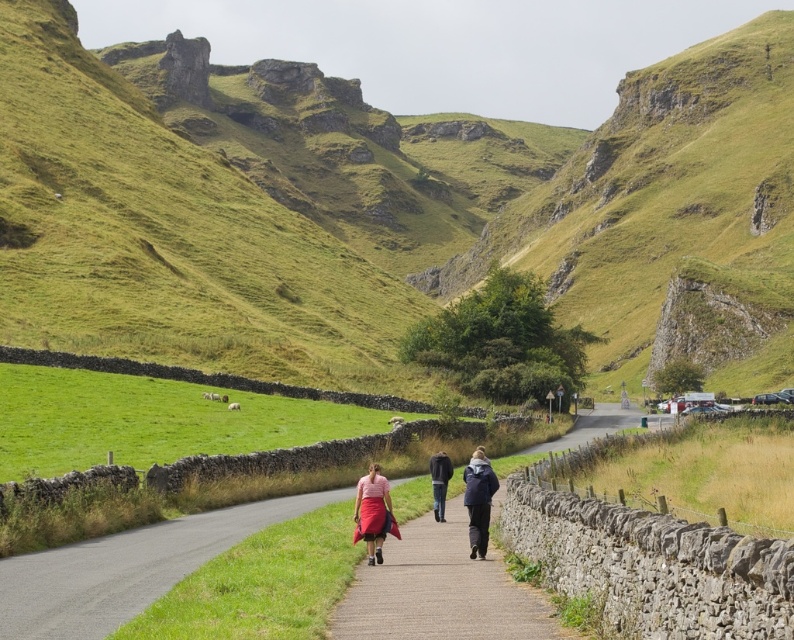
Which of these two, green grassy hillside at center or matte pink skirt at center, stands taller?

green grassy hillside at center

Can you confirm if green grassy hillside at center is bigger than matte pink skirt at center?

Correct, green grassy hillside at center is larger in size than matte pink skirt at center.

The image size is (794, 640). What are the coordinates of `green grassy hillside at center` in the screenshot? It's located at (357, 202).

Which is behind, point (703, 93) or point (436, 465)?

Positioned behind is point (703, 93).

What do you see at coordinates (357, 202) in the screenshot?
I see `green grassy hillside at center` at bounding box center [357, 202].

Which is behind, point (33, 124) or point (432, 486)?

The point (33, 124) is more distant.

Find the location of a particular element. green grassy hillside at center is located at coordinates (357, 202).

Looking at this image, is matte pink skirt at center to the right of dark blue jacket at center from the viewer's perspective?

Incorrect, matte pink skirt at center is not on the right side of dark blue jacket at center.

Who is more forward, (x=378, y=524) or (x=471, y=477)?

Point (x=378, y=524) is in front.

Identify the location of matte pink skirt at center. (372, 513).